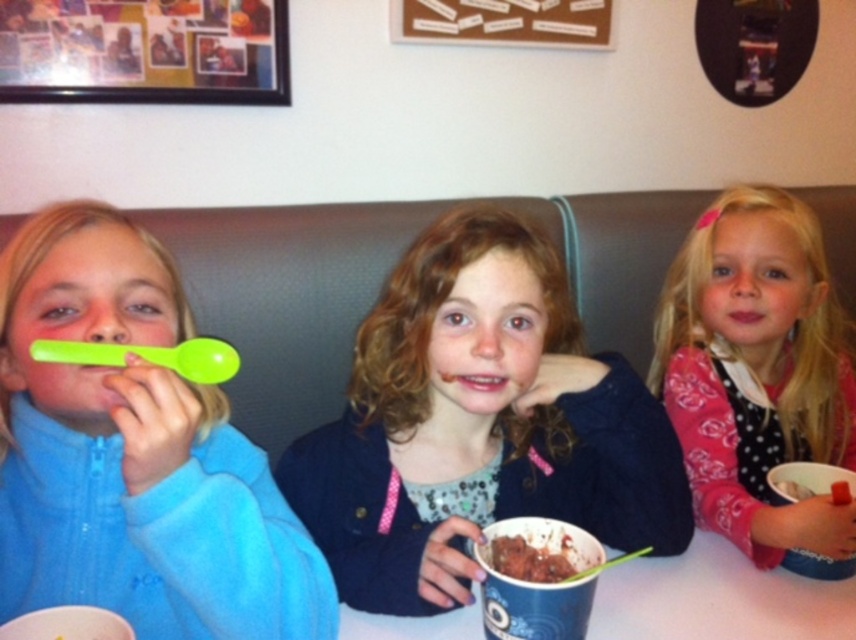
Does matte green spoon at left have a smaller size compared to pink glossy lips at center?

No.

Is matte green spoon at left further to the viewer compared to pink glossy lips at center?

No, matte green spoon at left is closer to the viewer.

Locate an element on the screen. matte green spoon at left is located at coordinates (134, 454).

Measure the distance from white matte table at center to matte pink lips at center.

white matte table at center and matte pink lips at center are 16.60 inches apart.

Does white matte table at center have a greater height compared to matte pink lips at center?

Indeed, white matte table at center has a greater height compared to matte pink lips at center.

Measure the distance between white matte table at center and camera.

They are 29.29 inches apart.

The image size is (856, 640). In order to click on white matte table at center in this screenshot , I will do `click(717, 598)`.

Is matte blue sweater at center taller than matte green spoon at left?

Yes, matte blue sweater at center is taller than matte green spoon at left.

Who is shorter, matte blue sweater at center or matte green spoon at left?

With less height is matte green spoon at left.

Image resolution: width=856 pixels, height=640 pixels. Identify the location of matte blue sweater at center. (479, 424).